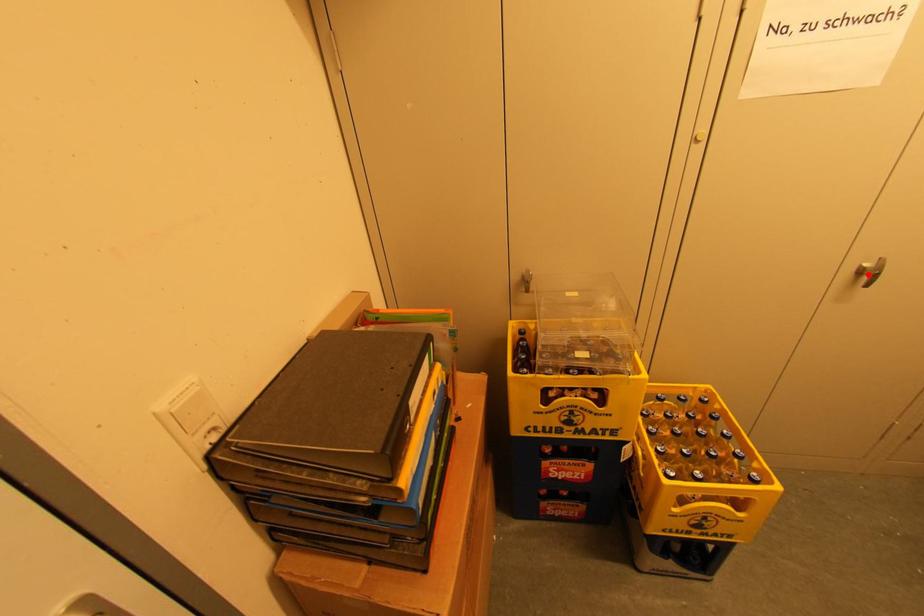
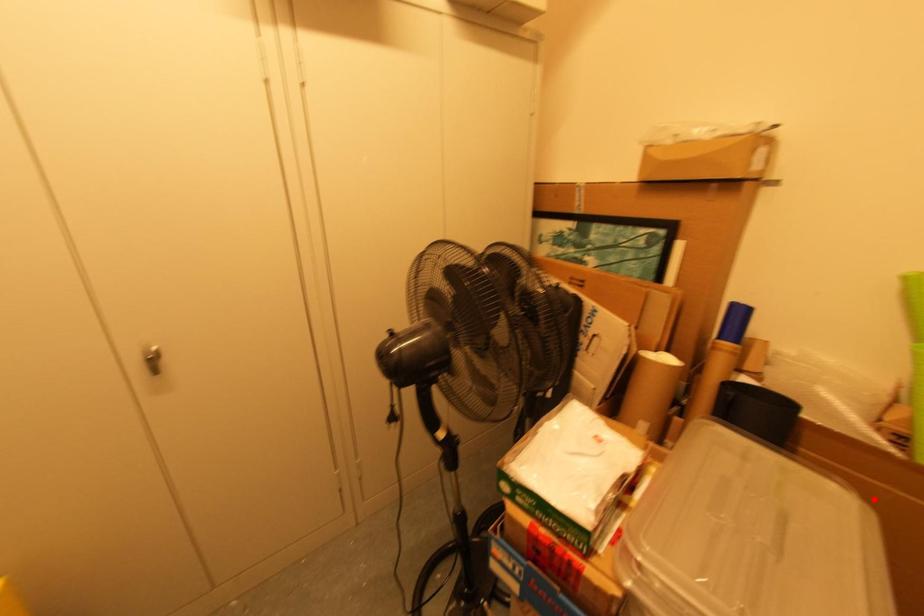
I am providing you with two images of the same scene from different viewpoints. A red point is marked on the first image and another point is marked on the second image. Do the highlighted points in image1 and image2 indicate the same real-world spot?

No